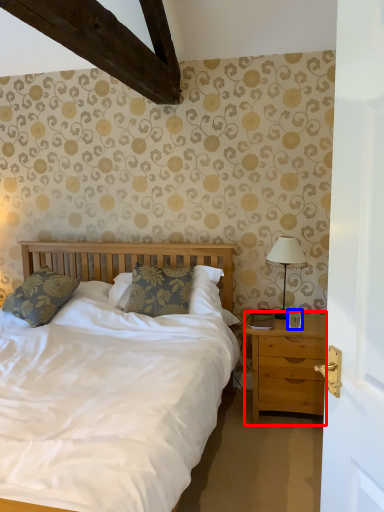
Question: Which object appears closest to the camera in this image, nightstand (highlighted by a red box) or coffee cup (highlighted by a blue box)?

Choices:
 (A) nightstand
 (B) coffee cup

Answer: (A)